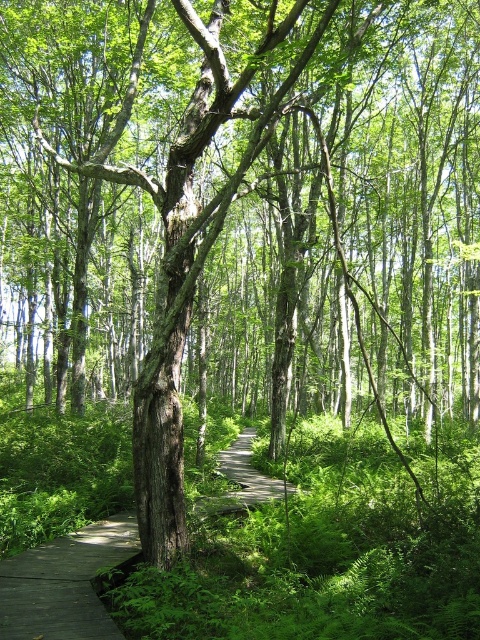
Is wooden at center wider than wooden boardwalk at center?

Indeed, wooden at center has a greater width compared to wooden boardwalk at center.

Measure the distance from wooden at center to wooden boardwalk at center.

wooden at center is 1.57 meters from wooden boardwalk at center.

Consider the image. Measure the distance between wooden at center and camera.

The distance of wooden at center from camera is 3.77 meters.

I want to click on wooden at center, so click(x=64, y=582).